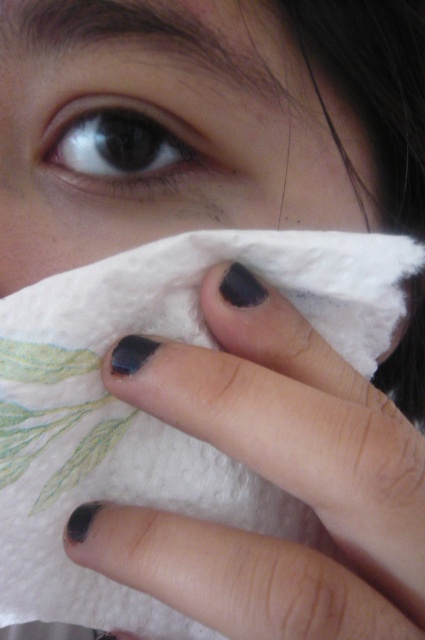
Looking at this image, you are an interior designer assessing the contrast in a photo. The scene has a white paper towel at lower center and a black matte eye at upper left. Which object has a greater width?

The white paper towel at lower center has a greater width than the black matte eye at upper left.

You are an artist sketching this scene. You need to draw the dark matte nail polish at center and the black matte eye at upper left. Which object should you draw first if you want to start from the left side of the image?

The black matte eye at upper left should be drawn first since it is located on the left side of the dark matte nail polish at center.

You are a photographer adjusting lighting for a closeup portrait. You notice the white paper towel at lower center and the dark matte nail polish at center. Which object is located to the left of the other?

The white paper towel at lower center is positioned on the left side of dark matte nail polish at center.